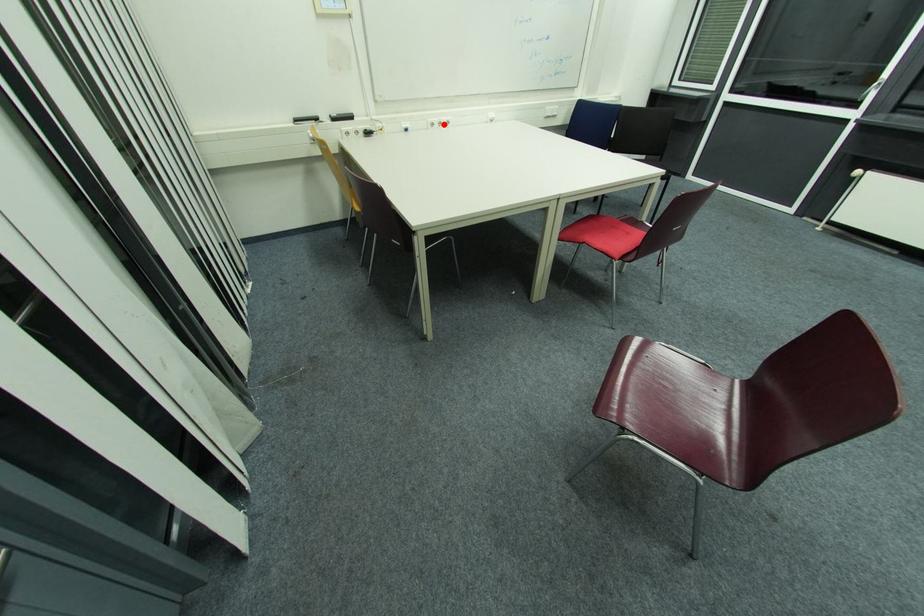
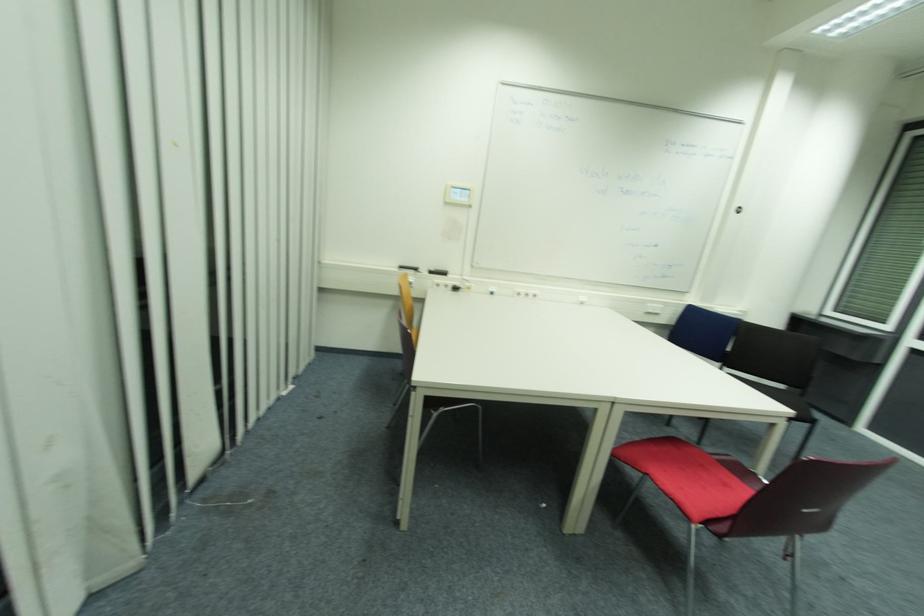
The point at the highlighted location is marked in the first image. Where is the corresponding point in the second image?

(529, 294)